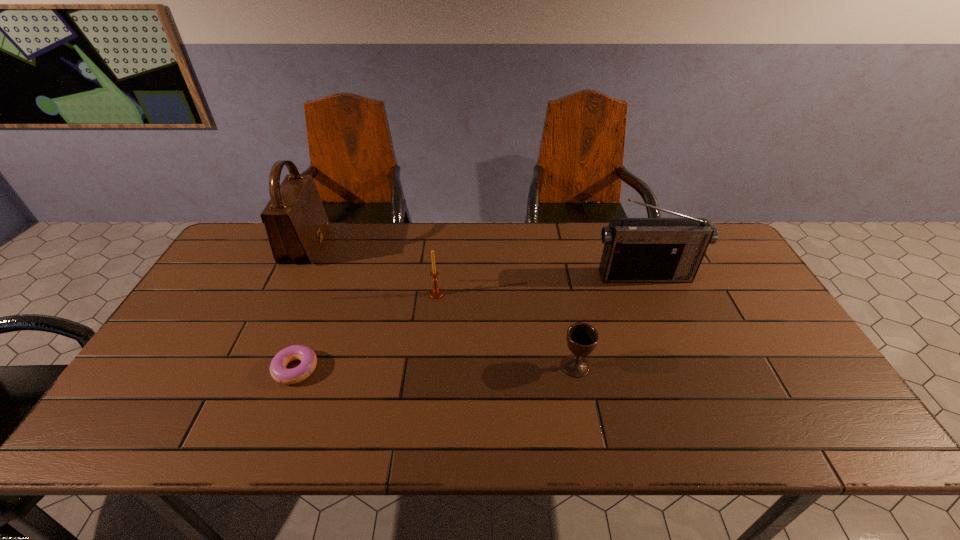
Identify the location of the leftmost object. The image size is (960, 540). (296, 223).

Where is `radio receiver`? The height and width of the screenshot is (540, 960). radio receiver is located at coordinates (636, 250).

Locate an element on the screen. the third object from right to left is located at coordinates (436, 293).

At what (x,y) coordinates should I click in order to perform the action: click on the third tallest object. Please return your answer as a coordinate pair (x, y). Looking at the image, I should click on (436, 293).

This screenshot has height=540, width=960. Find the location of `the second object from right to left`. the second object from right to left is located at coordinates (582, 338).

Locate an element on the screen. The height and width of the screenshot is (540, 960). chalice is located at coordinates (582, 338).

This screenshot has height=540, width=960. Find the location of `the second object from left to right`. the second object from left to right is located at coordinates (279, 372).

The width and height of the screenshot is (960, 540). I want to click on the shortest object, so pos(279,372).

Locate an element on the screen. The height and width of the screenshot is (540, 960). blank space located 0.300m on the front flap of the shoulder bag is located at coordinates (414, 245).

Where is `free region located 0.090m on the front-facing side of the radio receiver`? The height and width of the screenshot is (540, 960). free region located 0.090m on the front-facing side of the radio receiver is located at coordinates (657, 305).